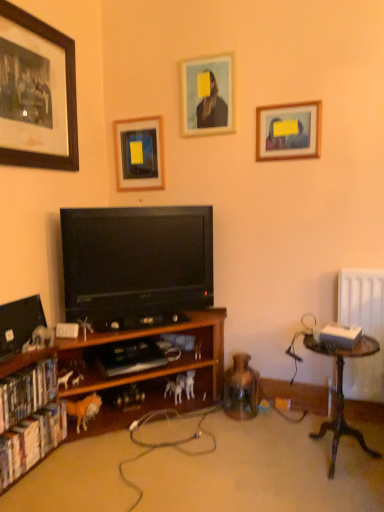
Locate an element on the screen. vacant area that lies between white matte horse at lower center, placed as the first animal when sorted from right to left, and wooden table at right is located at coordinates (249, 434).